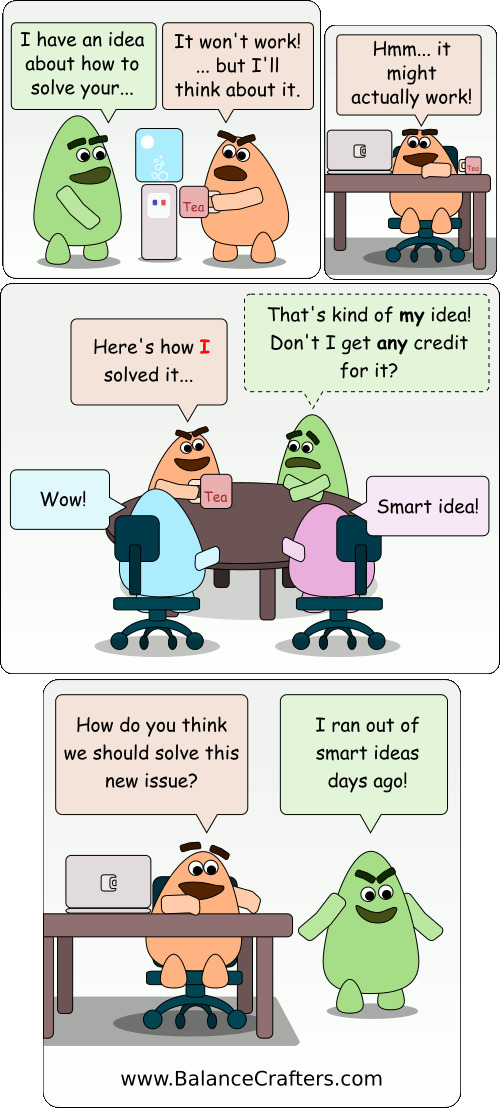
At what (x,y) coordinates should I click in order to perform the action: click on mug. Please return your answer as a coordinate pair (x, y). Looking at the image, I should click on (191, 199), (477, 162), (215, 483).